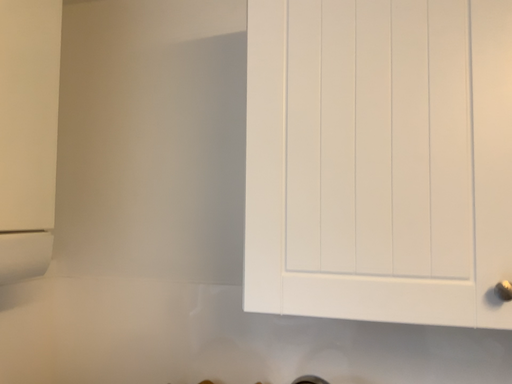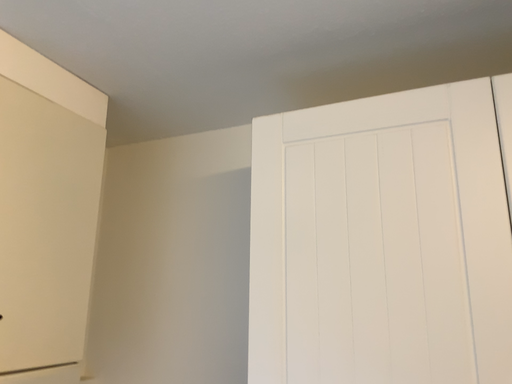
Question: How did the camera likely rotate when shooting the video?

Choices:
 (A) rotated downward
 (B) rotated upward

Answer: (B)